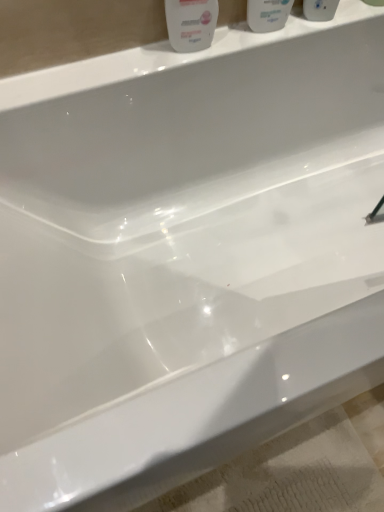
Question: Is white glossy bottle at upper center to the left of white glossy mouthwash at upper center, positioned as the 2th mouthwash in left-to-right order, from the viewer's perspective?

Choices:
 (A) yes
 (B) no

Answer: (A)

Question: Is white glossy bottle at upper center with white glossy mouthwash at upper center, which is counted as the 1th mouthwash, starting from the right?

Choices:
 (A) yes
 (B) no

Answer: (B)

Question: From the image's perspective, is white glossy bottle at upper center under white glossy mouthwash at upper center, positioned as the 2th mouthwash in left-to-right order?

Choices:
 (A) no
 (B) yes

Answer: (B)

Question: Does white glossy bottle at upper center have a greater height compared to white glossy mouthwash at upper center, which is counted as the 1th mouthwash, starting from the right?

Choices:
 (A) no
 (B) yes

Answer: (A)

Question: Is the position of white glossy bottle at upper center more distant than that of white glossy mouthwash at upper center, positioned as the 2th mouthwash in left-to-right order?

Choices:
 (A) no
 (B) yes

Answer: (A)

Question: Looking at their shapes, would you say white glossy bottle at upper center is wider or thinner than white glossy mouthwash at upper center, the 1th mouthwash in the left-to-right sequence?

Choices:
 (A) wide
 (B) thin

Answer: (B)

Question: In the image, is white glossy bottle at upper center on the left side or the right side of white glossy mouthwash at upper center, the 1th mouthwash in the left-to-right sequence?

Choices:
 (A) left
 (B) right

Answer: (A)

Question: Does point (193, 33) appear closer or farther from the camera than point (281, 8)?

Choices:
 (A) farther
 (B) closer

Answer: (B)

Question: From a real-world perspective, is white glossy bottle at upper center above or below white glossy mouthwash at upper center, marked as the second mouthwash in a right-to-left arrangement?

Choices:
 (A) below
 (B) above

Answer: (A)

Question: In terms of width, does white glossy mouthwash at upper center, marked as the second mouthwash in a right-to-left arrangement, look wider or thinner when compared to white glossy bottle at upper center?

Choices:
 (A) wide
 (B) thin

Answer: (A)

Question: Is white glossy mouthwash at upper center, marked as the second mouthwash in a right-to-left arrangement, taller or shorter than white glossy bottle at upper center?

Choices:
 (A) tall
 (B) short

Answer: (B)

Question: From a real-world perspective, is white glossy mouthwash at upper center, marked as the second mouthwash in a right-to-left arrangement, positioned above or below white glossy bottle at upper center?

Choices:
 (A) above
 (B) below

Answer: (A)

Question: Would you say white glossy mouthwash at upper center, marked as the second mouthwash in a right-to-left arrangement, is to the left or to the right of white glossy bottle at upper center in the picture?

Choices:
 (A) right
 (B) left

Answer: (A)

Question: Considering the positions of white glossy mouthwash at upper center, marked as the second mouthwash in a right-to-left arrangement, and white glossy mouthwash at upper center, which is counted as the 1th mouthwash, starting from the right, in the image, is white glossy mouthwash at upper center, marked as the second mouthwash in a right-to-left arrangement, taller or shorter than white glossy mouthwash at upper center, which is counted as the 1th mouthwash, starting from the right,?

Choices:
 (A) tall
 (B) short

Answer: (B)

Question: Relative to white glossy mouthwash at upper center, which is counted as the 1th mouthwash, starting from the right, is white glossy mouthwash at upper center, marked as the second mouthwash in a right-to-left arrangement, in front or behind?

Choices:
 (A) behind
 (B) front

Answer: (B)